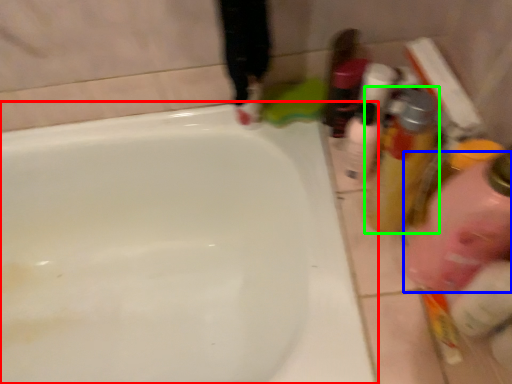
Question: Which object is the closest to the bathtub (highlighted by a red box)? Choose among these: cleaning product (highlighted by a blue box) or mouthwash (highlighted by a green box).

Choices:
 (A) cleaning product
 (B) mouthwash

Answer: (B)